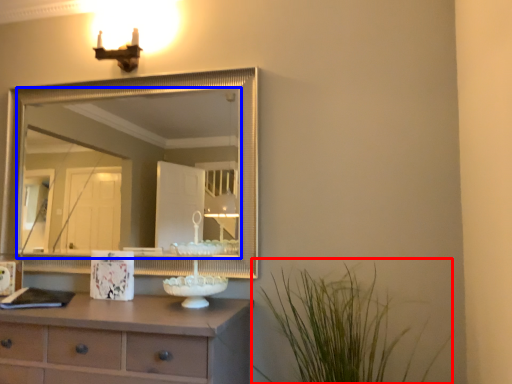
Question: Which of the following is the closest to the observer, plant (highlighted by a red box) or mirror (highlighted by a blue box)?

Choices:
 (A) plant
 (B) mirror

Answer: (A)